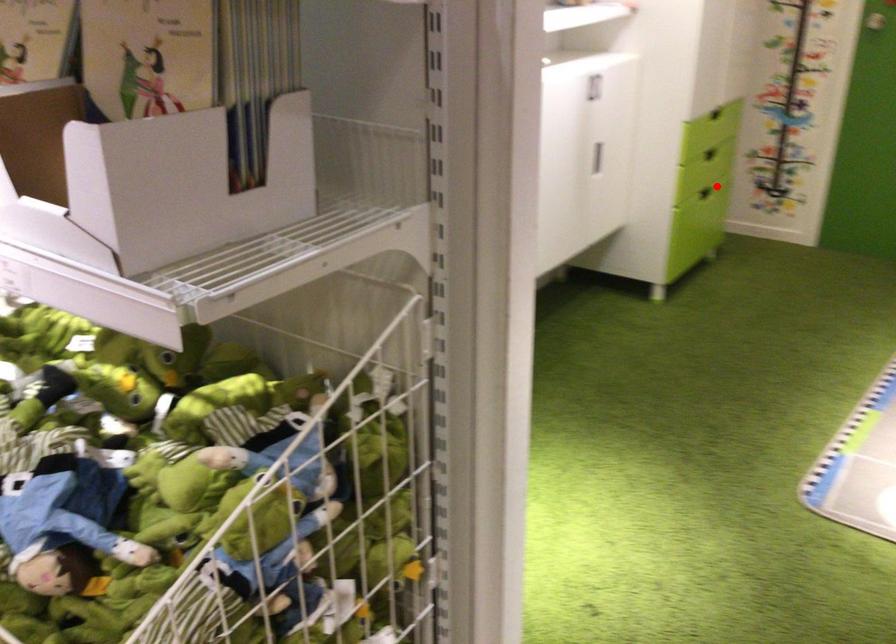
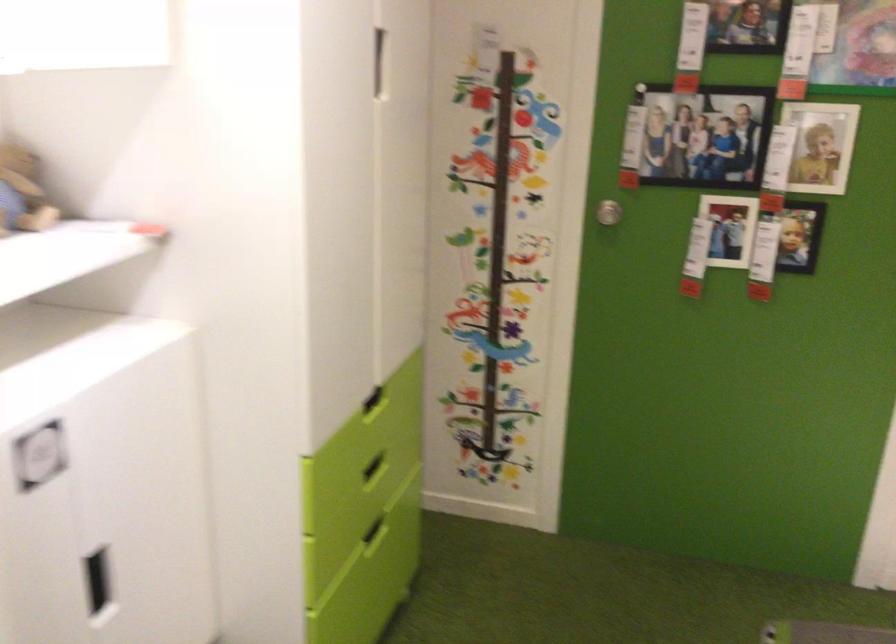
The point at the highlighted location is marked in the first image. Where is the corresponding point in the second image?

(375, 531)